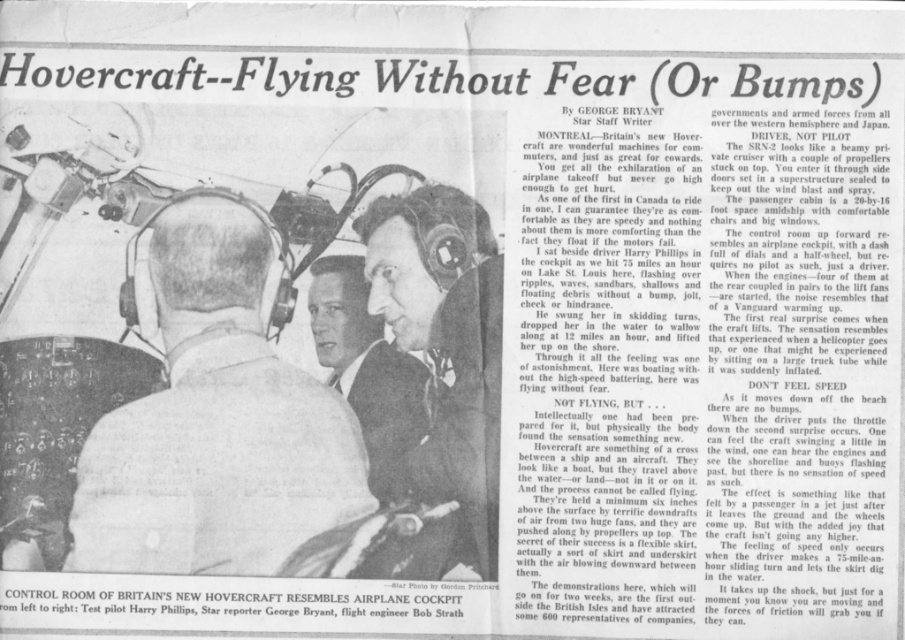
Is white leather jacket at center below matte black helmet at center?

Yes.

Locate an element on the screen. This screenshot has width=905, height=640. white leather jacket at center is located at coordinates (215, 420).

The image size is (905, 640). In order to click on white leather jacket at center in this screenshot , I will do `click(215, 420)`.

Is matte black helmet at center wider than light brown suit jacket at center?

Correct, the width of matte black helmet at center exceeds that of light brown suit jacket at center.

Who is more distant from viewer, (417,330) or (350,340)?

The point (350,340) is more distant.

Find the location of `matte black helmet at center`. matte black helmet at center is located at coordinates (445, 339).

Is white leather jacket at center below light brown suit jacket at center?

Yes.

Which is more to the left, white leather jacket at center or light brown suit jacket at center?

From the viewer's perspective, white leather jacket at center appears more on the left side.

Who is more forward, (267,227) or (396,426)?

Positioned in front is point (396,426).

Where is `white leather jacket at center`? The image size is (905, 640). white leather jacket at center is located at coordinates (215, 420).